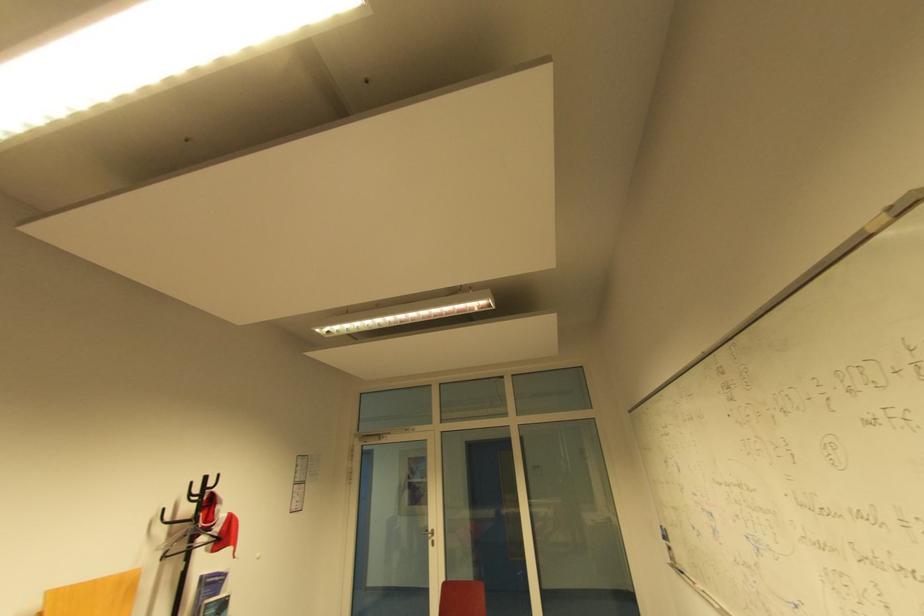
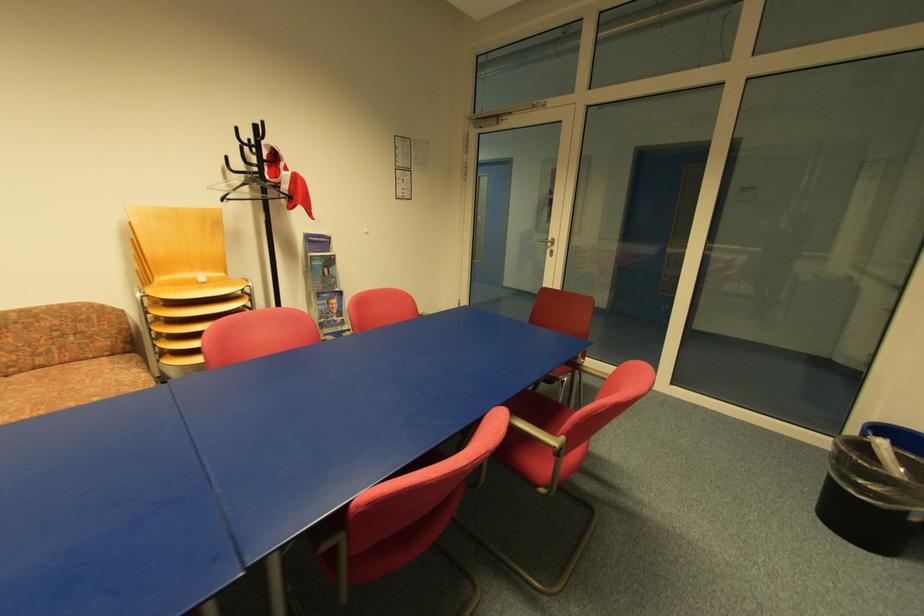
In the second image, find the point that corresponds to (x=197, y=485) in the first image.

(239, 130)